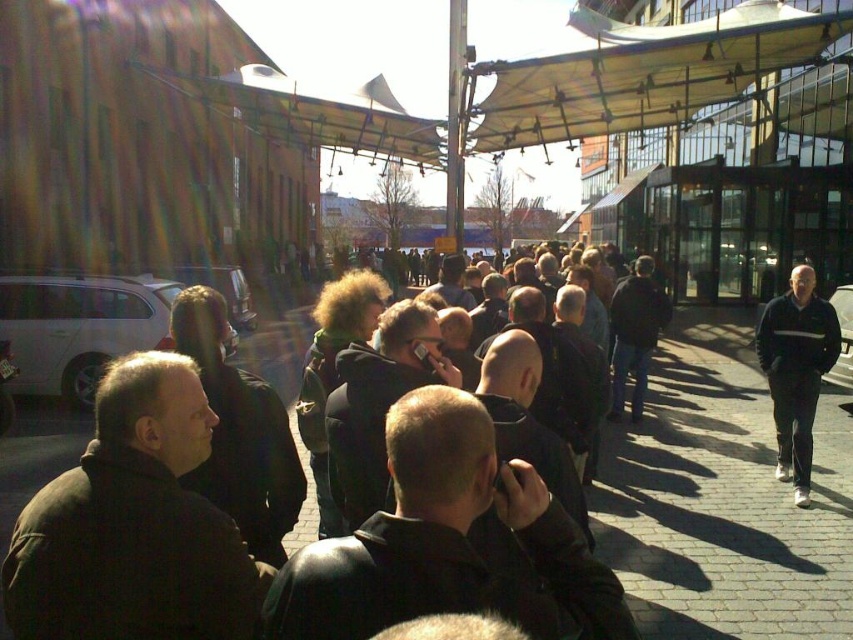
Can you confirm if brick pavement at center-right is taller than beige fabric canopy at upper center?

No, brick pavement at center-right is not taller than beige fabric canopy at upper center.

Does brick pavement at center-right appear on the left side of beige fabric canopy at upper center?

Indeed, brick pavement at center-right is positioned on the left side of beige fabric canopy at upper center.

Where is `brick pavement at center-right`? This screenshot has width=853, height=640. brick pavement at center-right is located at coordinates (723, 499).

Is dark gray brick pavement at center to the right of black fabric jacket at right from the viewer's perspective?

Incorrect, dark gray brick pavement at center is not on the right side of black fabric jacket at right.

Which of these two, dark gray brick pavement at center or black fabric jacket at right, stands shorter?

Standing shorter between the two is dark gray brick pavement at center.

Which is behind, point (659, 394) or point (784, 465)?

The point (659, 394) is behind.

The height and width of the screenshot is (640, 853). What are the coordinates of `dark gray brick pavement at center` in the screenshot? It's located at (723, 499).

Is dark gray brick pavement at center smaller than dark brown leather jacket at left?

Incorrect, dark gray brick pavement at center is not smaller in size than dark brown leather jacket at left.

Is point (757, 532) positioned before point (216, 515)?

That is False.

The width and height of the screenshot is (853, 640). I want to click on dark gray brick pavement at center, so click(x=723, y=499).